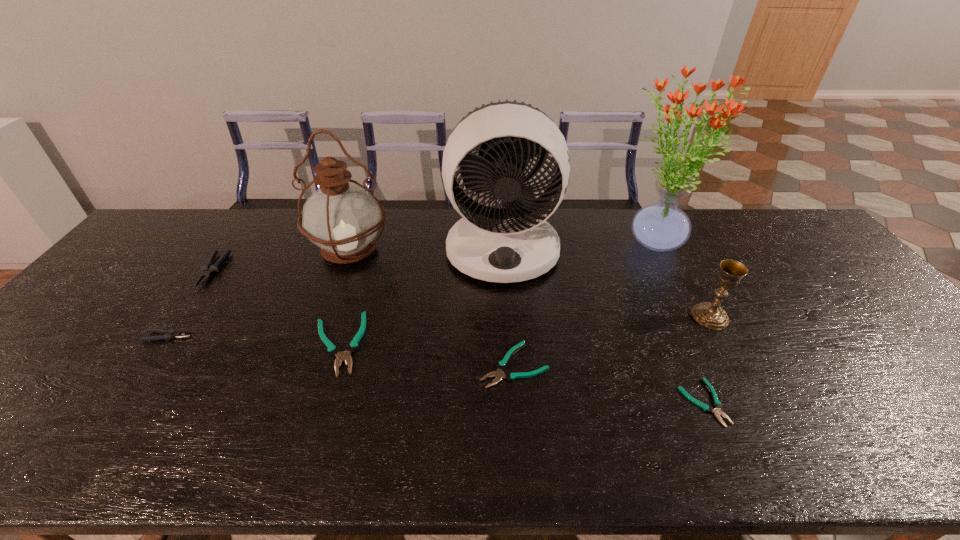
Find the location of a particular element. This screenshot has width=960, height=540. the eighth tallest object is located at coordinates (499, 374).

What are the coordinates of `the second teal pliers from right to left` in the screenshot? It's located at (499, 374).

Locate an element on the screen. This screenshot has height=540, width=960. the shortest object is located at coordinates [717, 404].

The image size is (960, 540). I want to click on the rightmost teal pliers, so tap(717, 404).

Where is `blank area located 0.260m on the front of the flower arrangement`? This screenshot has height=540, width=960. blank area located 0.260m on the front of the flower arrangement is located at coordinates (699, 330).

The height and width of the screenshot is (540, 960). I want to click on free spot located on the grille of the fan, so click(513, 407).

Where is `blank space located 0.360m on the left of the oil lamp`? The image size is (960, 540). blank space located 0.360m on the left of the oil lamp is located at coordinates (198, 250).

Identify the location of free space located on the right of the chalice. The image size is (960, 540). (835, 316).

At what (x,y) coordinates should I click in order to perform the action: click on free space located at the gripping part of the fifth shortest object. Please return your answer as a coordinate pair (x, y). The height and width of the screenshot is (540, 960). Looking at the image, I should click on pyautogui.click(x=130, y=387).

This screenshot has width=960, height=540. Identify the location of vacant space located at the gripping part of the smaller gray pliers. (321, 336).